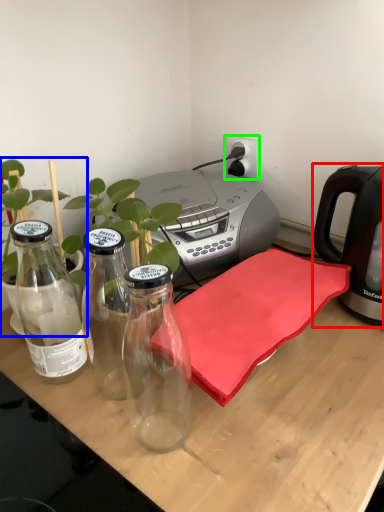
Question: Estimate the real-world distances between objects in this image. Which object is closer to kettle (highlighted by a red box), houseplant (highlighted by a blue box) or electric outlet (highlighted by a green box)?

Choices:
 (A) houseplant
 (B) electric outlet

Answer: (B)